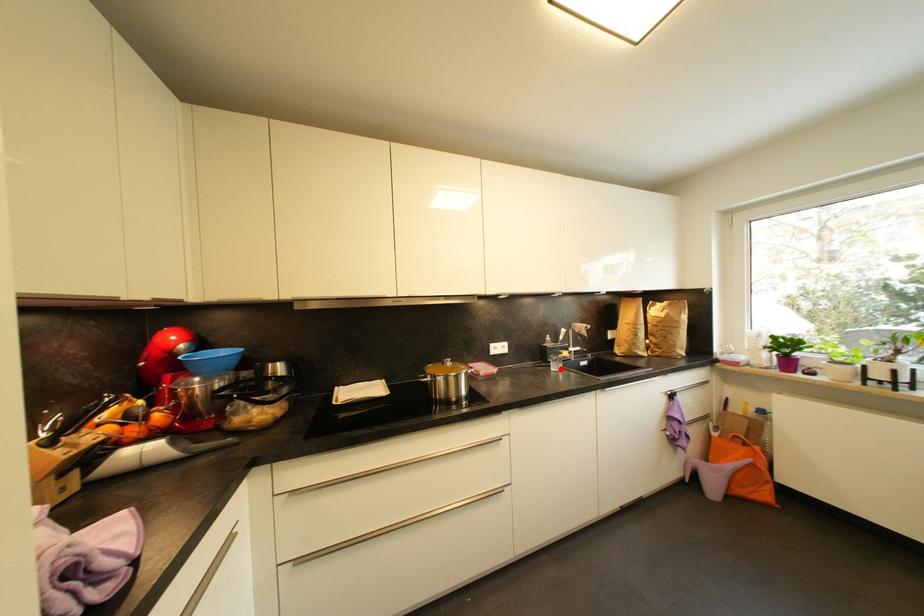
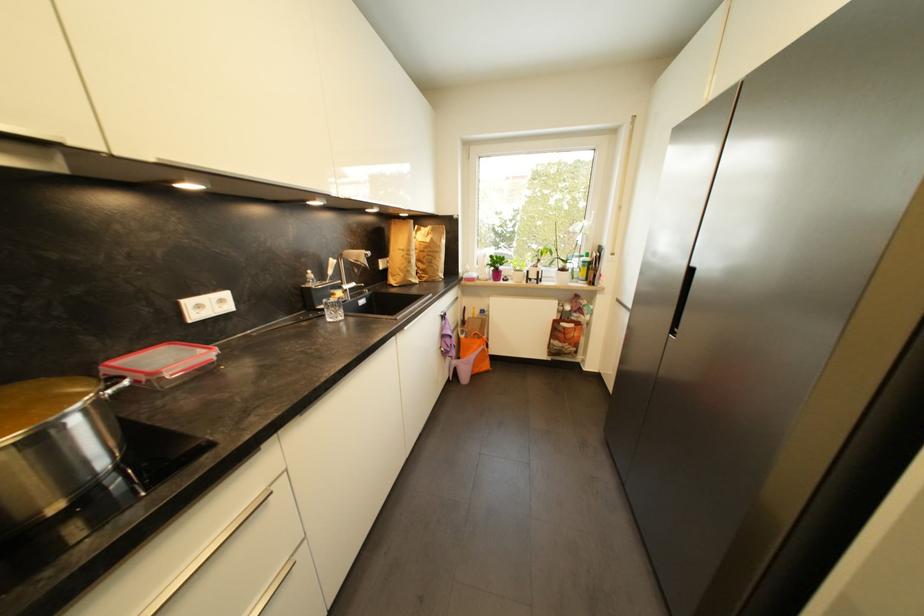
The point at the highlighted location is marked in the first image. Where is the corresponding point in the second image?

(339, 317)